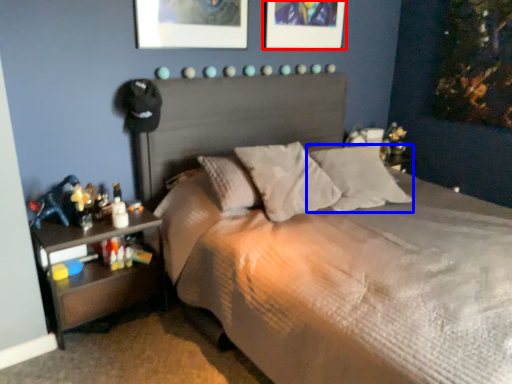
Question: Among these objects, which one is farthest to the camera, picture frame (highlighted by a red box) or pillow (highlighted by a blue box)?

Choices:
 (A) picture frame
 (B) pillow

Answer: (A)